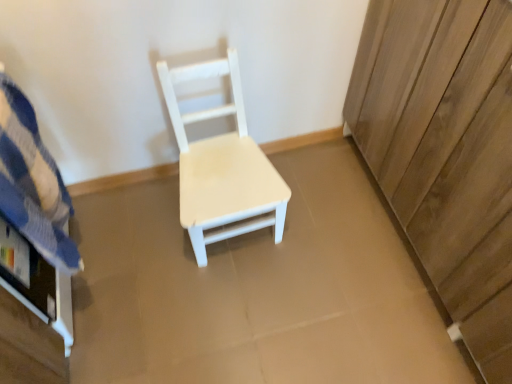
At what (x,y) coordinates should I click in order to perform the action: click on wooden dresser at right. Please return your answer as a coordinate pair (x, y). Looking at the image, I should click on click(x=445, y=152).

Find the location of a particular element. white matte wood chair at center is located at coordinates (222, 166).

In order to face blue striped fabric at left, should I rotate leftwards or rightwards?

A 27.154 degree turn to the left will do.

This screenshot has width=512, height=384. What are the coordinates of `wooden dresser at right` in the screenshot? It's located at (445, 152).

Is white matte wood chair at center outside of wooden dresser at right?

white matte wood chair at center lies outside wooden dresser at right's area.

Is the surface of white matte wood chair at center in direct contact with wooden dresser at right?

No, white matte wood chair at center is not beside wooden dresser at right.

This screenshot has height=384, width=512. I want to click on chair lying behind the wooden dresser at right, so click(222, 166).

How much distance is there between white matte wood chair at center and wooden dresser at right?

white matte wood chair at center is 19.04 inches from wooden dresser at right.

From the image's perspective, between blue striped fabric at left and white matte wood chair at center, which one is located above?

white matte wood chair at center.

Based on the photo, from a real-world perspective, relative to white matte wood chair at center, is blue striped fabric at left vertically above or below?

blue striped fabric at left is situated higher than white matte wood chair at center in the real world.

Based on the photo, could you tell me if blue striped fabric at left is turned towards white matte wood chair at center?

Yes, blue striped fabric at left faces towards white matte wood chair at center.

From the image's perspective, is blue striped fabric at left located beneath wooden dresser at right?

Yes.

Are blue striped fabric at left and wooden dresser at right making contact?

blue striped fabric at left and wooden dresser at right are not in contact.

Which is nearer, (23, 183) or (408, 1)?

Point (23, 183).

Is blue striped fabric at left at the right side of wooden dresser at right?

No.

Which object is further away from the camera, wooden dresser at right or white matte wood chair at center?

white matte wood chair at center is further from the camera.

From the image's perspective, between wooden dresser at right and white matte wood chair at center, which one is located above?

wooden dresser at right appears higher in the image.

Based on the photo, is wooden dresser at right taller or shorter than white matte wood chair at center?

wooden dresser at right is taller than white matte wood chair at center.

In the image, is wooden dresser at right on the left side or the right side of white matte wood chair at center?

From the image, it's evident that wooden dresser at right is to the right of white matte wood chair at center.

Does white matte wood chair at center have a larger size compared to blue striped fabric at left?

Indeed, white matte wood chair at center has a larger size compared to blue striped fabric at left.

Based on the photo, between white matte wood chair at center and blue striped fabric at left, which one has more height?

white matte wood chair at center is taller.

Is point (211, 175) closer to camera compared to point (60, 230)?

No, it is not.

Is wooden dresser at right at the right side of blue striped fabric at left?

Correct, you'll find wooden dresser at right to the right of blue striped fabric at left.

Between wooden dresser at right and blue striped fabric at left, which one has more height?

With more height is wooden dresser at right.

Considering the sizes of objects wooden dresser at right and blue striped fabric at left in the image provided, who is wider, wooden dresser at right or blue striped fabric at left?

With larger width is wooden dresser at right.

Could blue striped fabric at left be considered to be inside wooden dresser at right?

That's incorrect, blue striped fabric at left is not inside wooden dresser at right.

Locate an element on the screen. The image size is (512, 384). dresser above the white matte wood chair at center (from a real-world perspective) is located at coordinates (445, 152).

Where is `chair to the right of blue striped fabric at left`? The width and height of the screenshot is (512, 384). chair to the right of blue striped fabric at left is located at coordinates (222, 166).

Considering their positions, is white matte wood chair at center positioned closer to blue striped fabric at left than wooden dresser at right?

Among the two, white matte wood chair at center is located nearer to blue striped fabric at left.

Which object lies nearer to the anchor point wooden dresser at right, blue striped fabric at left or white matte wood chair at center?

Among the two, white matte wood chair at center is located nearer to wooden dresser at right.

From the image, which object appears to be farther from blue striped fabric at left, wooden dresser at right or white matte wood chair at center?

wooden dresser at right lies further to blue striped fabric at left than the other object.

Which object lies nearer to the anchor point white matte wood chair at center, wooden dresser at right or blue striped fabric at left?

Based on the image, blue striped fabric at left appears to be nearer to white matte wood chair at center.

Consider the image. Based on their spatial positions, is white matte wood chair at center or blue striped fabric at left closer to wooden dresser at right?

white matte wood chair at center is positioned closer to the anchor wooden dresser at right.

From the image, which object appears to be farther from white matte wood chair at center, blue striped fabric at left or wooden dresser at right?

wooden dresser at right is positioned further to the anchor white matte wood chair at center.

I want to click on chair between blue striped fabric at left and wooden dresser at right from left to right, so click(x=222, y=166).